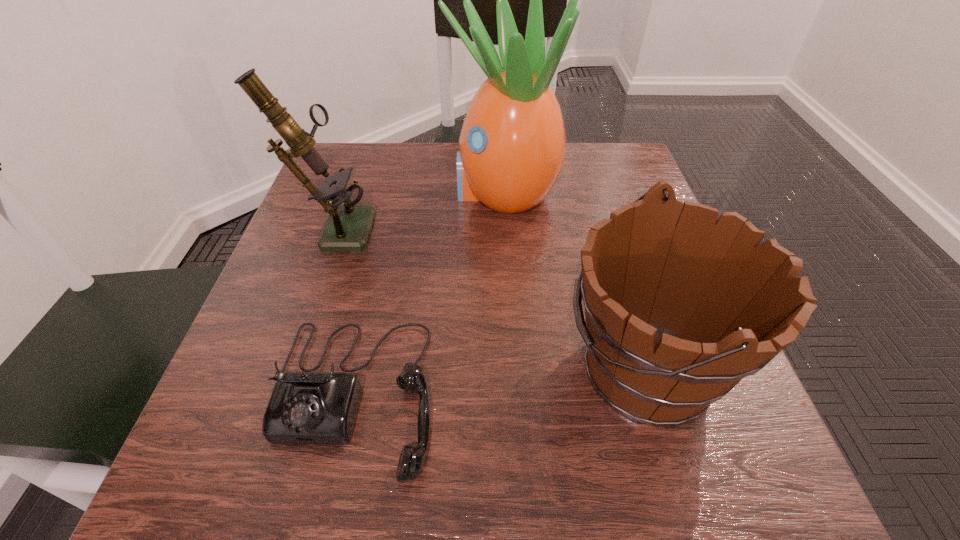
At what (x,y) coordinates should I click in order to perform the action: click on free space between the shortest object and the pineapple. Please return your answer as a coordinate pair (x, y). The height and width of the screenshot is (540, 960). Looking at the image, I should click on (428, 294).

Find the location of a particular element. This screenshot has width=960, height=540. vacant space that's between the wine bucket and the pineapple is located at coordinates (573, 279).

You are a GUI agent. You are given a task and a screenshot of the screen. Output one action in this format:
    pyautogui.click(x=<x>, y=<y>)
    Task: Click on the free spot between the shortest object and the second tallest object
    The height and width of the screenshot is (540, 960).
    Given the screenshot: What is the action you would take?
    pyautogui.click(x=344, y=311)

Where is `vacant space that's between the tallest object and the microscope`? The height and width of the screenshot is (540, 960). vacant space that's between the tallest object and the microscope is located at coordinates (419, 209).

Locate an element on the screen. The height and width of the screenshot is (540, 960). unoccupied area between the pineapple and the microscope is located at coordinates (419, 209).

Find the location of a particular element. The width and height of the screenshot is (960, 540). free space between the tallest object and the third tallest object is located at coordinates (573, 279).

Choose which object is the nearest neighbor to the telephone. Please provide its 2D coordinates. Your answer should be formatted as a tuple, i.e. [(x, y)], where the tuple contains the x and y coordinates of a point satisfying the conditions above.

[(348, 227)]

In order to click on the third closest object to the tallest object in this screenshot , I will do `click(309, 407)`.

The width and height of the screenshot is (960, 540). I want to click on free location that satisfies the following two spatial constraints: 1. at the entrance of the pineapple; 2. on the dial of the telephone, so click(516, 396).

Locate an element on the screen. The image size is (960, 540). vacant space that satisfies the following two spatial constraints: 1. at the entrance of the pineapple; 2. on the dial of the telephone is located at coordinates (516, 396).